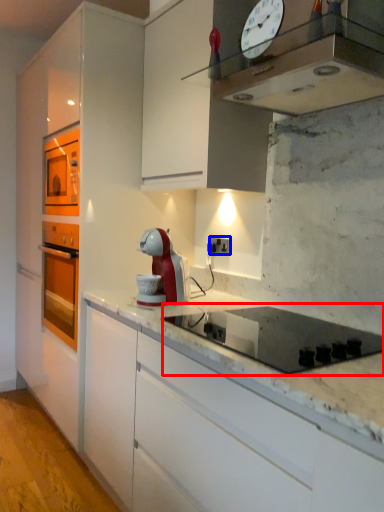
Question: Among these objects, which one is farthest to the camera, gas stove (highlighted by a red box) or electric outlet (highlighted by a blue box)?

Choices:
 (A) gas stove
 (B) electric outlet

Answer: (B)